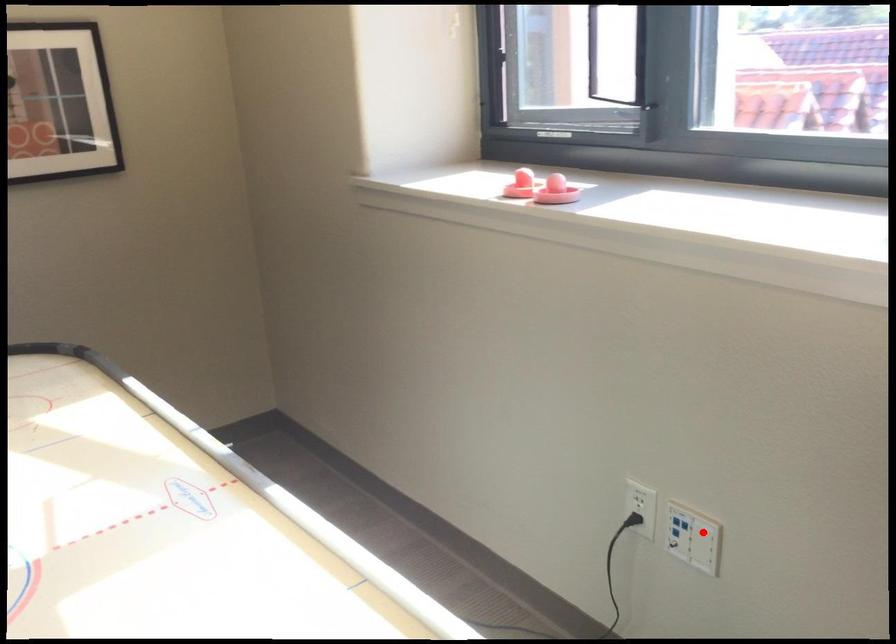
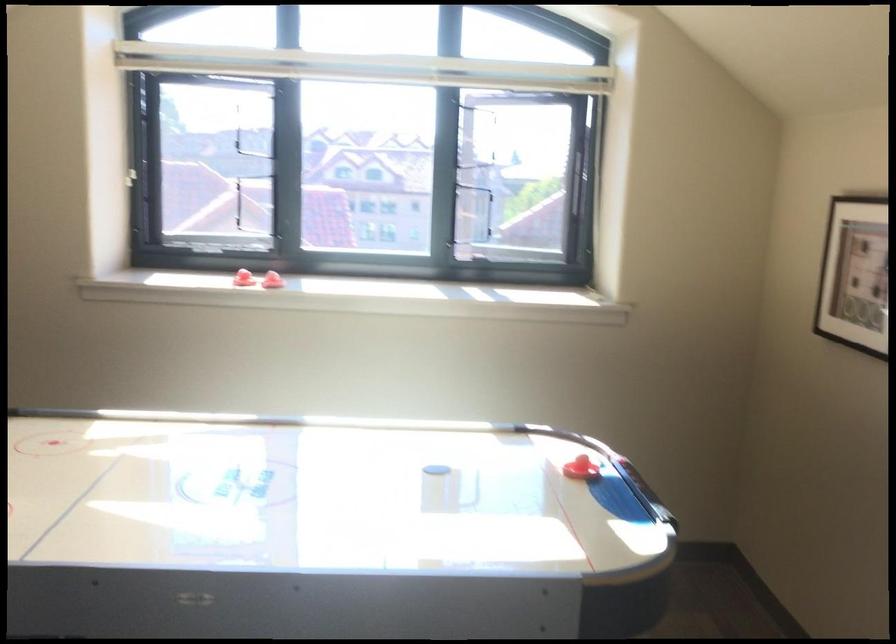
Question: I am providing you with two images of the same scene from different viewpoints. A red point is marked on the first image. Can you still see the location of the red point in image 2?

Choices:
 (A) Yes
 (B) No

Answer: (B)